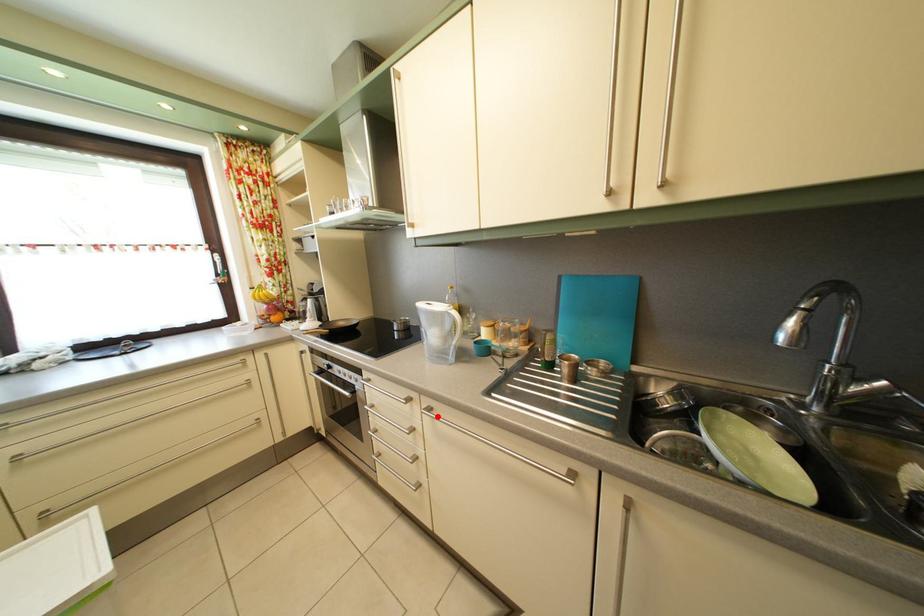
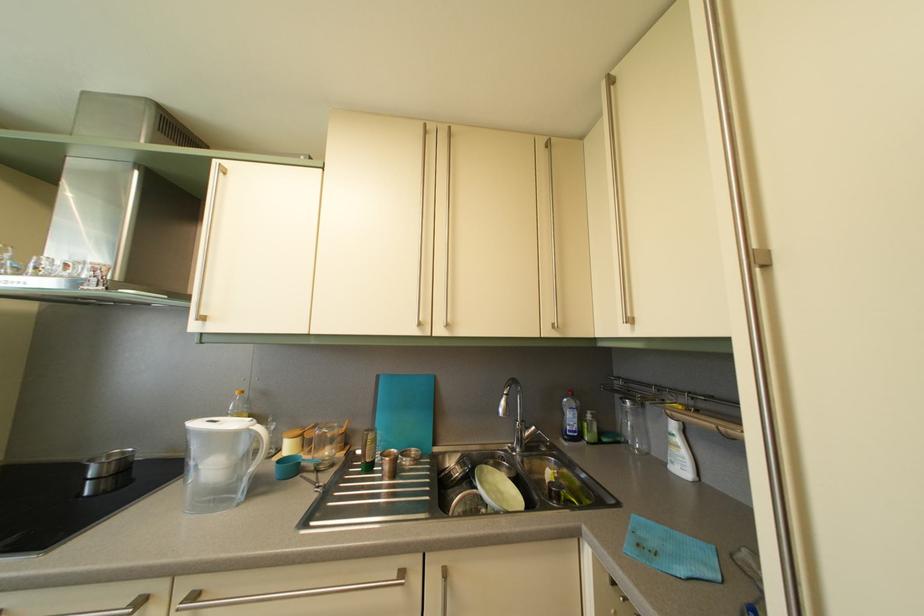
Where in the second image is the point corresponding to the highlighted location from the first image?

(202, 604)